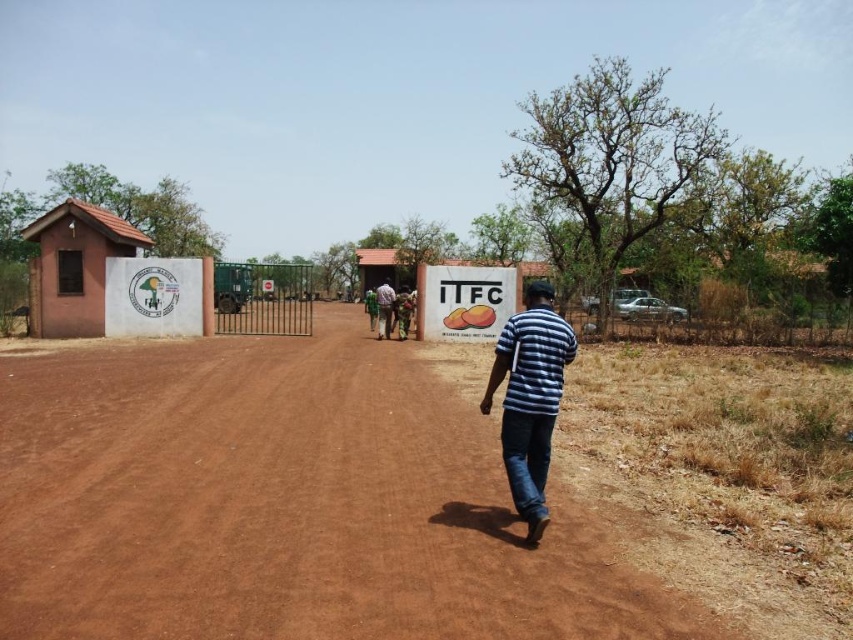
Question: Is brown dirt track at center to the right of brown clay hut at left from the viewer's perspective?

Choices:
 (A) yes
 (B) no

Answer: (A)

Question: Is striped fabric shirt at center to the left of brown clay hut at left from the viewer's perspective?

Choices:
 (A) no
 (B) yes

Answer: (A)

Question: Which object is the farthest from the green fabric shirt at center?

Choices:
 (A) brown clay hut at left
 (B) striped fabric shirt at center
 (C) white paper sign at center

Answer: (B)

Question: Which point is closer to the camera?

Choices:
 (A) (70, 220)
 (B) (550, 388)
 (C) (453, 548)
 (D) (393, 292)

Answer: (C)

Question: Among these objects, which one is nearest to the camera?

Choices:
 (A) brown clay hut at left
 (B) green fabric shirt at center

Answer: (A)

Question: Observing the image, what is the correct spatial positioning of brown dirt track at center in reference to green fabric shirt at center?

Choices:
 (A) right
 (B) left

Answer: (A)